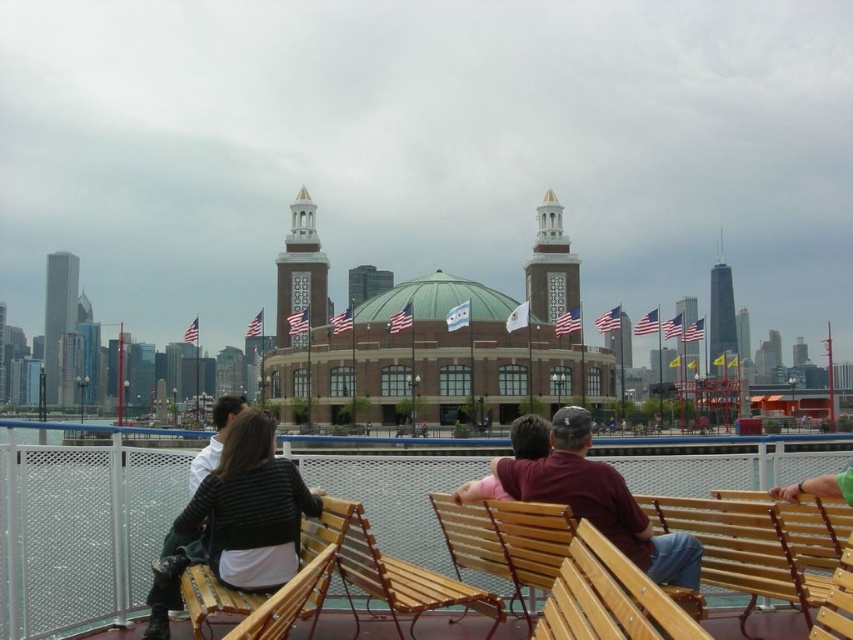
Question: Which point is farther from the camera taking this photo?

Choices:
 (A) [x=340, y=502]
 (B) [x=398, y=627]

Answer: (A)

Question: Considering the real-world distances, which object is closest to the maroon fabric shirt at center?

Choices:
 (A) shiny glass skyscraper at left
 (B) wooden slats bench at center

Answer: (B)

Question: Can you confirm if wooden bench at center is positioned below shiny glass skyscraper at left?

Choices:
 (A) yes
 (B) no

Answer: (A)

Question: Can you confirm if wooden bench at center is positioned above shiny glass skyscraper at center right?

Choices:
 (A) yes
 (B) no

Answer: (B)

Question: Where is wooden bench at center located in relation to matte brick tower at center in the image?

Choices:
 (A) above
 (B) below

Answer: (B)

Question: Which object appears closest to the camera in this image?

Choices:
 (A) brown brick tower at center
 (B) striped sweater at center

Answer: (B)